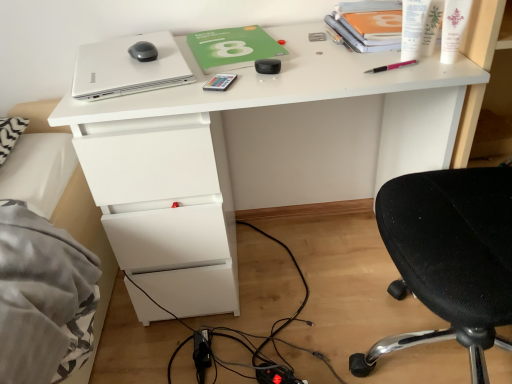
Image resolution: width=512 pixels, height=384 pixels. I want to click on vacant space in between green matte notebook at center and white paper towel at upper right, positioned as the fourth stationery in left-to-right order, so point(320,54).